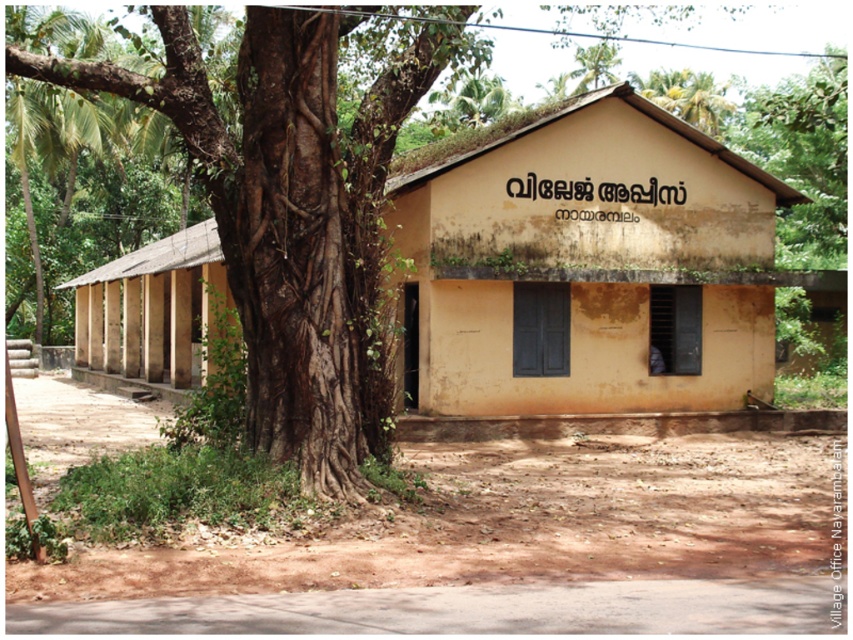
Who is higher up, brown rough bark tree at center or light brown wooden hut at left?

Positioned higher is brown rough bark tree at center.

Between point (312, 216) and point (74, 333), which one is positioned in front?

Point (312, 216)

Does point (461, 33) come farther from viewer compared to point (219, 264)?

No, (461, 33) is in front of (219, 264).

In order to click on brown rough bark tree at center in this screenshot , I will do `click(297, 208)`.

Does yellowish matte building at center lie in front of light brown wooden hut at left?

No, yellowish matte building at center is behind light brown wooden hut at left.

Who is more forward, (718, 243) or (86, 320)?

Point (718, 243) is in front.

Image resolution: width=853 pixels, height=640 pixels. I want to click on yellowish matte building at center, so click(x=585, y=266).

This screenshot has height=640, width=853. What do you see at coordinates (585, 266) in the screenshot?
I see `yellowish matte building at center` at bounding box center [585, 266].

Between yellowish matte building at center and brown rough bark tree at center, which one appears on the right side from the viewer's perspective?

From the viewer's perspective, yellowish matte building at center appears more on the right side.

Is point (680, 284) less distant than point (178, 129)?

No.

Where is `yellowish matte building at center`? The image size is (853, 640). yellowish matte building at center is located at coordinates (585, 266).